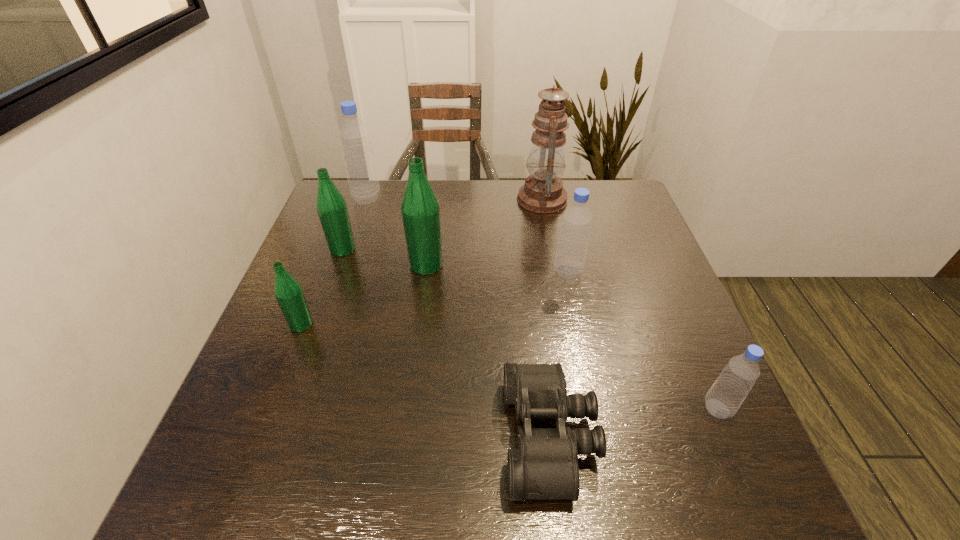
This screenshot has height=540, width=960. I want to click on vacant space that is in between the fourth object from left to right and the binoculars, so [x=488, y=350].

I want to click on vacant space in between the third nearest object and the farthest bottle, so click(334, 261).

The width and height of the screenshot is (960, 540). I want to click on free spot between the nearest green bottle and the second bottle from right to left, so click(x=435, y=298).

This screenshot has height=540, width=960. I want to click on object that is the fourth closest to the second blue bottle from right to left, so click(x=724, y=398).

Select which object is the sixth closest to the oil lamp. Please provide its 2D coordinates. Your answer should be formatted as a tuple, i.e. [(x, y)], where the tuple contains the x and y coordinates of a point satisfying the conditions above.

[(724, 398)]

I want to click on the third closest bottle to the oil lamp, so click(x=354, y=136).

Identify which bottle is located as the fourth nearest to the black binoculars. Please provide its 2D coordinates. Your answer should be formatted as a tuple, i.e. [(x, y)], where the tuple contains the x and y coordinates of a point satisfying the conditions above.

[(288, 292)]

Locate which blue bottle is the second closest to the nearest bottle. Please provide its 2D coordinates. Your answer should be formatted as a tuple, i.e. [(x, y)], where the tuple contains the x and y coordinates of a point satisfying the conditions above.

[(354, 136)]

Locate an element on the screen. This screenshot has height=540, width=960. blue bottle that is the nearest to the second smallest green bottle is located at coordinates (354, 136).

Locate an element on the screen. This screenshot has height=540, width=960. the third closest green bottle to the black binoculars is located at coordinates (331, 206).